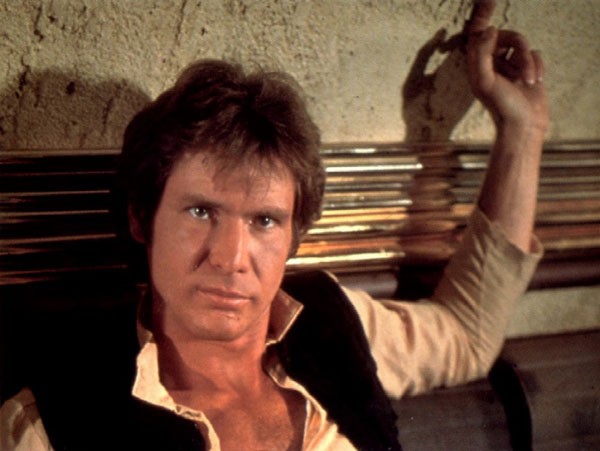
I want to click on the chest, so click(x=254, y=436).